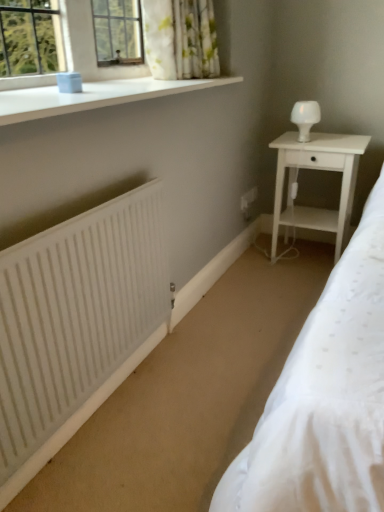
The width and height of the screenshot is (384, 512). Identify the location of vacant space in white matte radiator at lower left (from a real-world perspective). (109, 407).